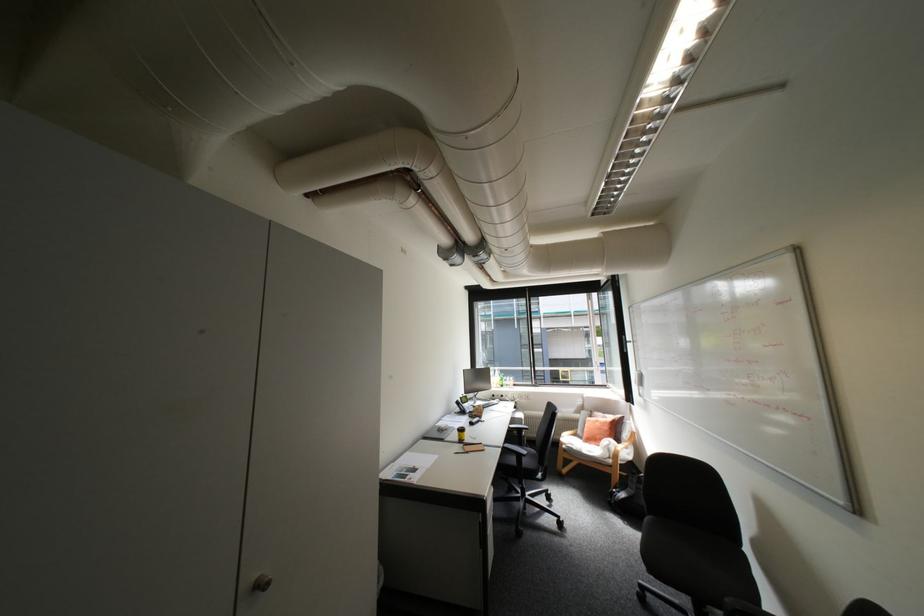
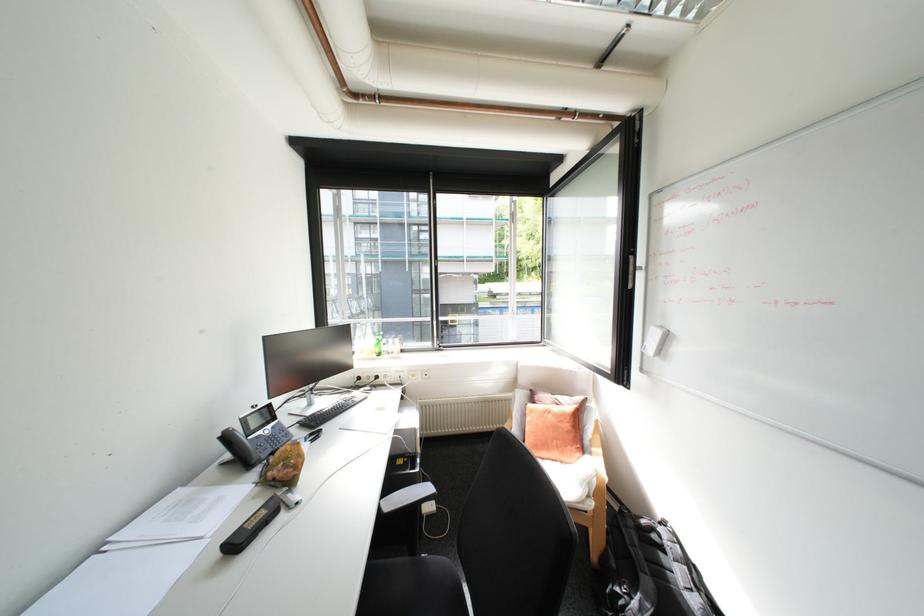
In the second image, find the point that corresponds to the point at 608,423 in the first image.

(561, 416)